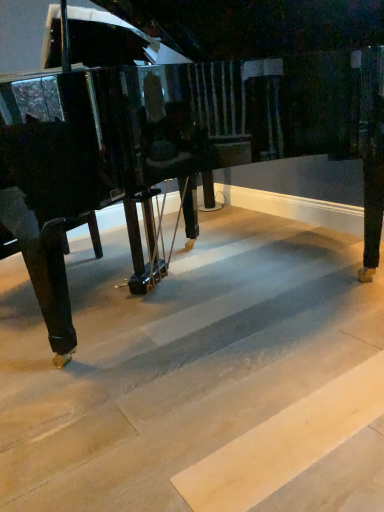
Question: Is light wood stair at center shorter than glossy black piano at center?

Choices:
 (A) no
 (B) yes

Answer: (B)

Question: Is light wood stair at center at the right side of glossy black piano at center?

Choices:
 (A) no
 (B) yes

Answer: (A)

Question: Can you confirm if light wood stair at center is smaller than glossy black piano at center?

Choices:
 (A) yes
 (B) no

Answer: (A)

Question: Is light wood stair at center not within glossy black piano at center?

Choices:
 (A) yes
 (B) no

Answer: (A)

Question: Is light wood stair at center turned away from glossy black piano at center?

Choices:
 (A) no
 (B) yes

Answer: (A)

Question: From a real-world perspective, is light wood stair at center on glossy black piano at center?

Choices:
 (A) no
 (B) yes

Answer: (A)

Question: Is glossy black piano at center bigger than light wood stair at center?

Choices:
 (A) no
 (B) yes

Answer: (B)

Question: From a real-world perspective, is glossy black piano at center physically below light wood stair at center?

Choices:
 (A) no
 (B) yes

Answer: (A)

Question: Is glossy black piano at center at the left side of light wood stair at center?

Choices:
 (A) no
 (B) yes

Answer: (A)

Question: Does glossy black piano at center lie in front of light wood stair at center?

Choices:
 (A) yes
 (B) no

Answer: (B)

Question: Is glossy black piano at center wider than light wood stair at center?

Choices:
 (A) no
 (B) yes

Answer: (A)

Question: Is glossy black piano at center beside light wood stair at center?

Choices:
 (A) no
 (B) yes

Answer: (A)

Question: Looking at the image, does glossy black piano at center seem bigger or smaller compared to light wood stair at center?

Choices:
 (A) big
 (B) small

Answer: (A)